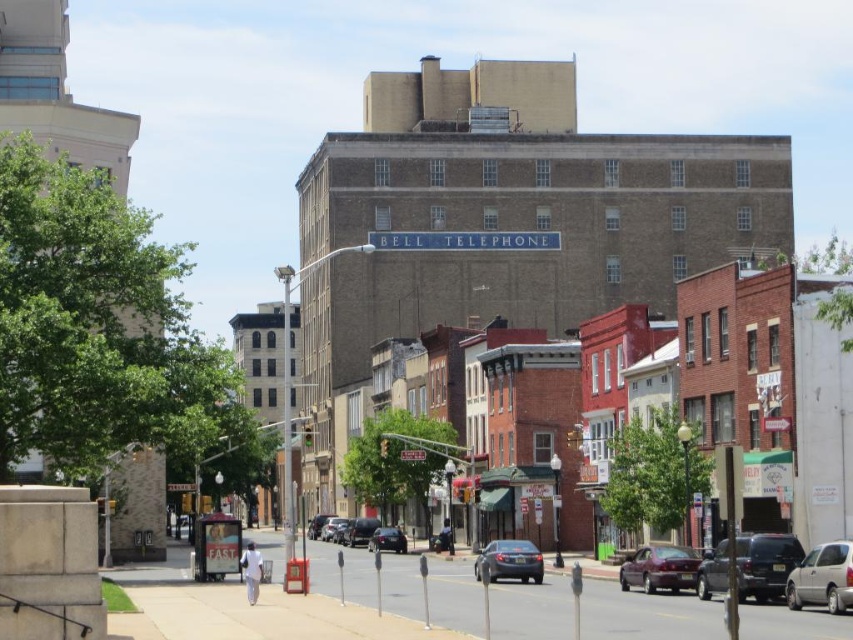
Question: Estimate the real-world distances between objects in this image. Which object is closer to the shiny black sedan at center?

Choices:
 (A) matte gray sedan at center
 (B) gray asphalt at center
 (C) matte black suv at center right

Answer: (B)

Question: Is silver metallic van at lower right positioned behind shiny black sedan at center?

Choices:
 (A) no
 (B) yes

Answer: (A)

Question: Which point is closer to the camera?

Choices:
 (A) (184, 548)
 (B) (480, 577)
 (C) (691, 570)
 (D) (321, 538)

Answer: (C)

Question: Can you confirm if shiny maroon sedan at lower right is positioned above shiny black car at center?

Choices:
 (A) yes
 (B) no

Answer: (A)

Question: Which object appears closest to the camera in this image?

Choices:
 (A) matte black suv at center right
 (B) gray asphalt at center
 (C) matte gray sedan at center
 (D) matte black car at center

Answer: (B)

Question: Is gray asphalt at center further to the viewer compared to matte gray sedan at center?

Choices:
 (A) no
 (B) yes

Answer: (A)